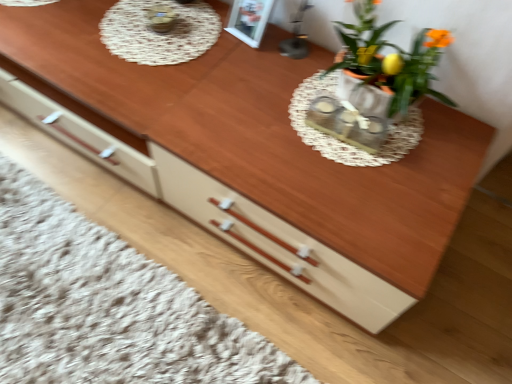
Identify the location of free space to the right of white lace doily at upper center. (247, 67).